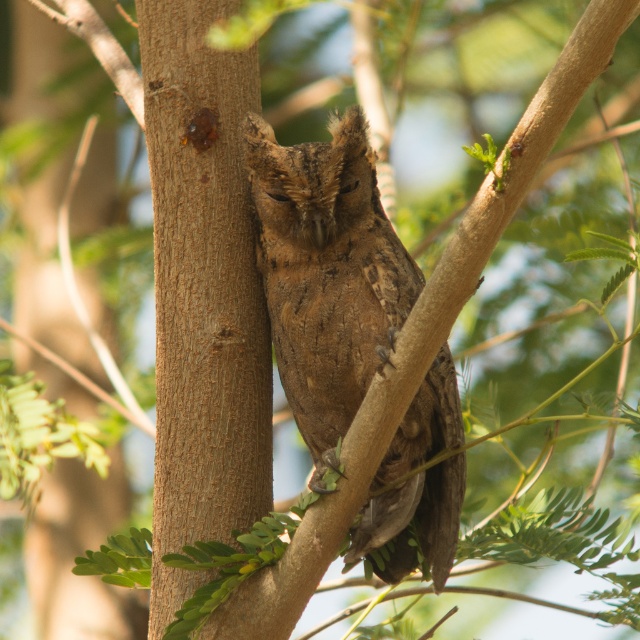
You are an ornithologist observing an owl in its natural habitat. You notice a point at coordinates (202, 292). Based on the scene description, what object does this point most likely correspond to?

The point at coordinates (202, 292) corresponds to the brown rough tree trunk at center, as stated in the objects description.

You are a birdwatcher trying to identify an owl in the image. The scene shows a brown rough tree trunk at center and a brown feathered owl at center. Which object is positioned higher in the image?

The brown rough tree trunk at center is located above the brown feathered owl at center, so it is positioned higher in the image.